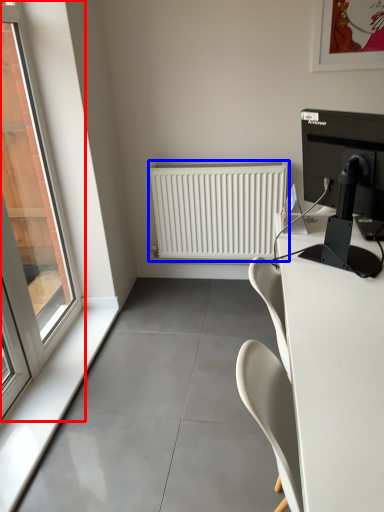
Question: Which object is closer to the camera taking this photo, window (highlighted by a red box) or radiator (highlighted by a blue box)?

Choices:
 (A) window
 (B) radiator

Answer: (A)